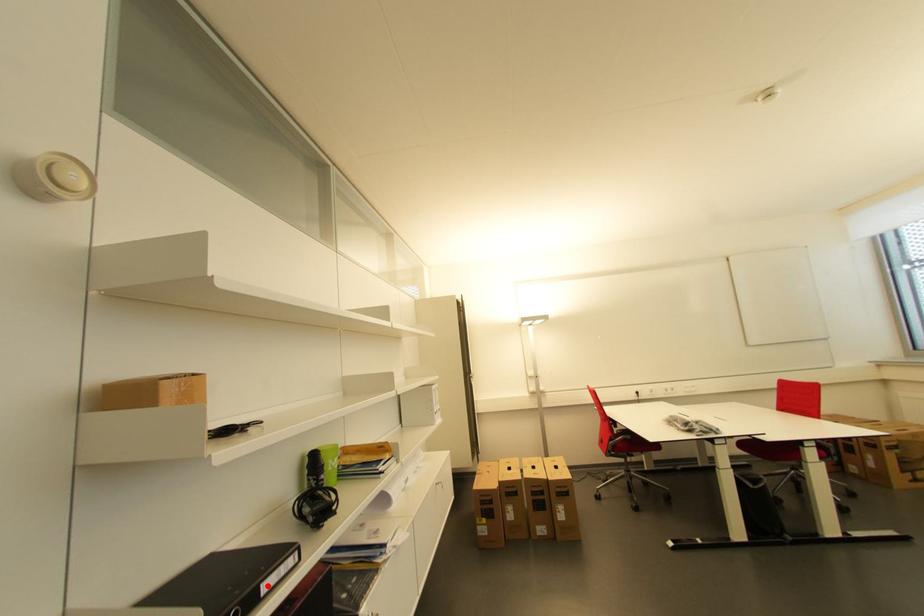
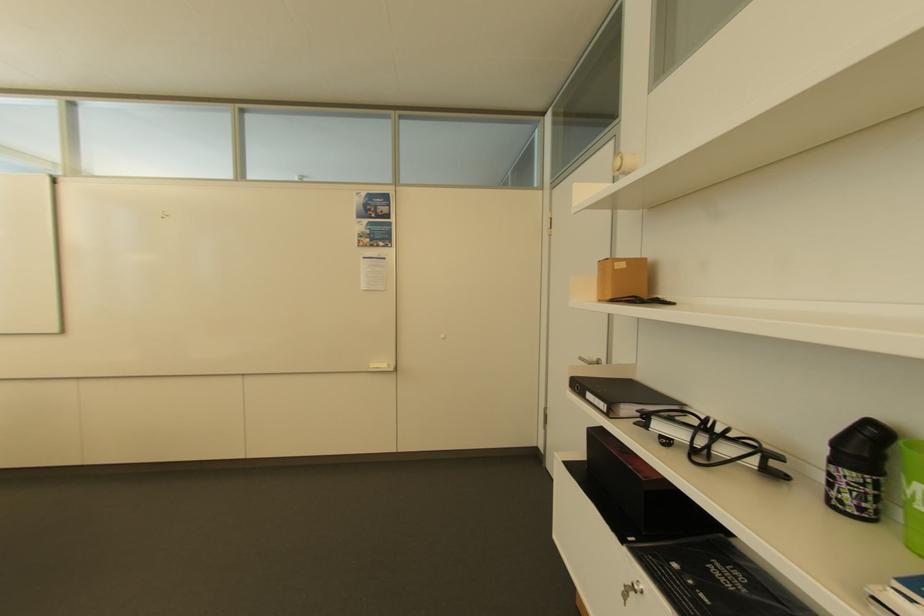
Where in the second image is the point corresponding to the highlighted location from the first image?

(592, 392)